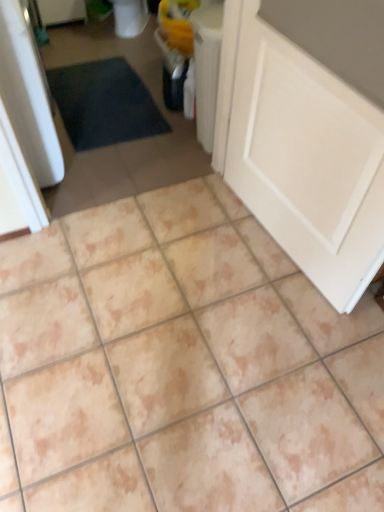
What is the approximate width of white matte door at lower right?

white matte door at lower right is 4.74 inches wide.

Find the location of a particular element. This screenshot has width=384, height=512. white matte door at lower right is located at coordinates (308, 132).

The image size is (384, 512). What do you see at coordinates (308, 132) in the screenshot?
I see `white matte door at lower right` at bounding box center [308, 132].

Identify the location of beige ceramic tile at center. click(182, 366).

What is the approximate height of beige ceramic tile at center?

It is 1.82 inches.

The height and width of the screenshot is (512, 384). Describe the element at coordinates (182, 366) in the screenshot. I see `beige ceramic tile at center` at that location.

Where is `white matte door at lower right`? white matte door at lower right is located at coordinates (308, 132).

Is white matte door at lower right to the left or to the right of beige ceramic tile at center in the image?

white matte door at lower right is to the right of beige ceramic tile at center.

Which object is more forward, white matte door at lower right or beige ceramic tile at center?

white matte door at lower right is in front.

Which is in front, point (348, 34) or point (196, 186)?

Positioned in front is point (348, 34).

From the image's perspective, between white matte door at lower right and beige ceramic tile at center, who is located below?

From the image's view, white matte door at lower right is below.

From a real-world perspective, which object rests below the other?

beige ceramic tile at center.

Which of these two, white matte door at lower right or beige ceramic tile at center, is thinner?

With smaller width is white matte door at lower right.

Is white matte door at lower right taller than beige ceramic tile at center?

Yes.

Considering the sizes of objects white matte door at lower right and beige ceramic tile at center in the image provided, who is smaller, white matte door at lower right or beige ceramic tile at center?

With smaller size is white matte door at lower right.

Which is correct: white matte door at lower right is inside beige ceramic tile at center, or outside of it?

white matte door at lower right is outside beige ceramic tile at center.

Is white matte door at lower right far away from beige ceramic tile at center?

No.

Is white matte door at lower right aimed at beige ceramic tile at center?

No, white matte door at lower right is not aimed at beige ceramic tile at center.

The image size is (384, 512). Identify the location of ceramic tile that appears below the white matte door at lower right (from a real-world perspective). (182, 366).

Does beige ceramic tile at center appear on the left side of white matte door at lower right?

Correct, you'll find beige ceramic tile at center to the left of white matte door at lower right.

Which object is more forward, beige ceramic tile at center or white matte door at lower right?

white matte door at lower right.

Does point (160, 420) come farther from viewer compared to point (311, 242)?

No, (160, 420) is closer to viewer.

In the scene shown: From the image's perspective, relative to white matte door at lower right, is beige ceramic tile at center above or below?

From the image's perspective, beige ceramic tile at center appears above white matte door at lower right.

From a real-world perspective, is beige ceramic tile at center positioned over white matte door at lower right based on gravity?

No, from a real-world perspective, beige ceramic tile at center is not on top of white matte door at lower right.

Looking at their sizes, would you say beige ceramic tile at center is wider or thinner than white matte door at lower right?

Clearly, beige ceramic tile at center has more width compared to white matte door at lower right.

Considering the sizes of objects beige ceramic tile at center and white matte door at lower right in the image provided, who is taller, beige ceramic tile at center or white matte door at lower right?

white matte door at lower right.

Does beige ceramic tile at center have a smaller size compared to white matte door at lower right?

Actually, beige ceramic tile at center might be larger than white matte door at lower right.

Based on the photo, choose the correct answer: Is beige ceramic tile at center inside white matte door at lower right or outside it?

beige ceramic tile at center is located beyond the bounds of white matte door at lower right.

Is the surface of beige ceramic tile at center in direct contact with white matte door at lower right?

No, beige ceramic tile at center is not beside white matte door at lower right.

Is beige ceramic tile at center positioned with its back to white matte door at lower right?

beige ceramic tile at center is not turned away from white matte door at lower right.

Can you tell me how much beige ceramic tile at center and white matte door at lower right differ in facing direction?

The angular difference between beige ceramic tile at center and white matte door at lower right is 173 degrees.

The image size is (384, 512). I want to click on ceramic tile located on the left of white matte door at lower right, so click(x=182, y=366).

The width and height of the screenshot is (384, 512). What are the coordinates of `ceramic tile above the white matte door at lower right (from the image's perspective)` in the screenshot? It's located at tap(182, 366).

What are the coordinates of `door in front of the beige ceramic tile at center` in the screenshot? It's located at (308, 132).